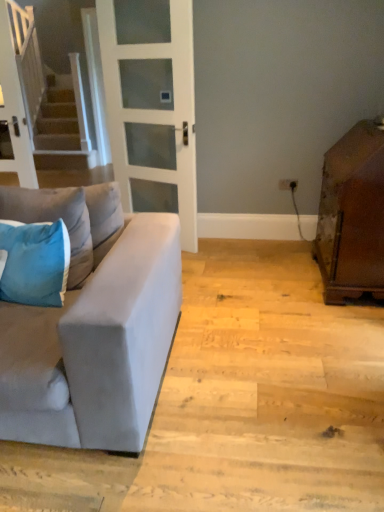
The height and width of the screenshot is (512, 384). I want to click on vacant space that is to the left of brown wooden cabinet at right, so click(269, 283).